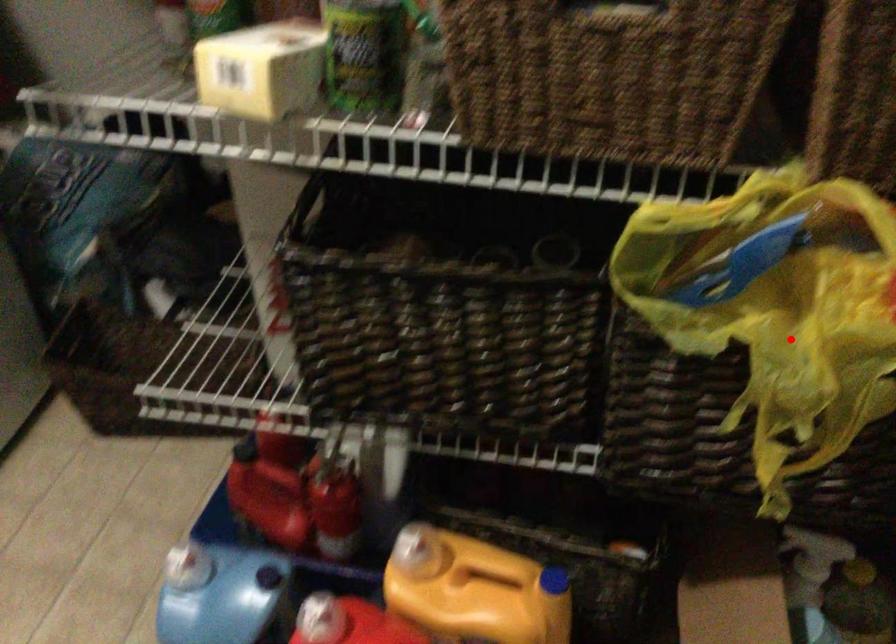
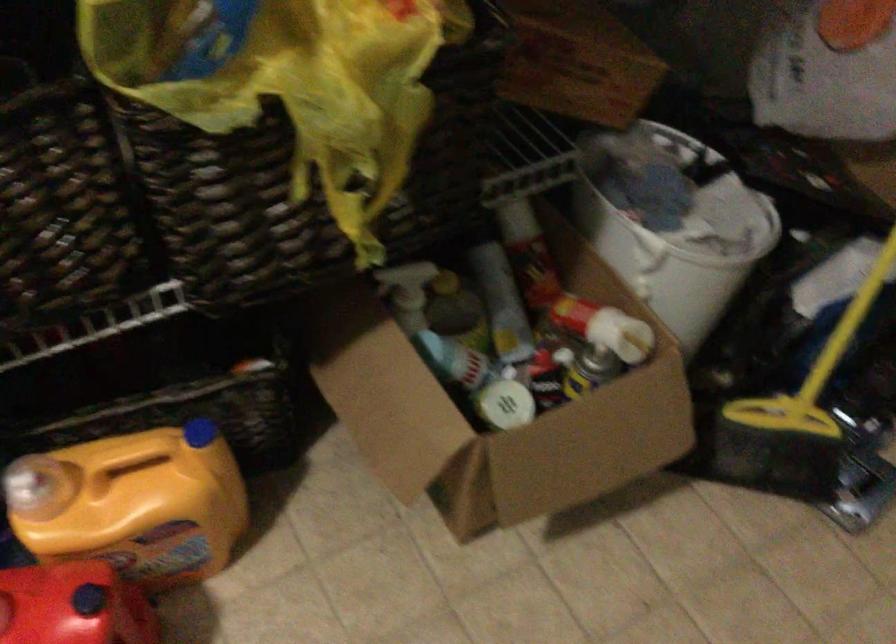
Find the pixel in the second image that matches the highlighted location in the first image.

(323, 84)